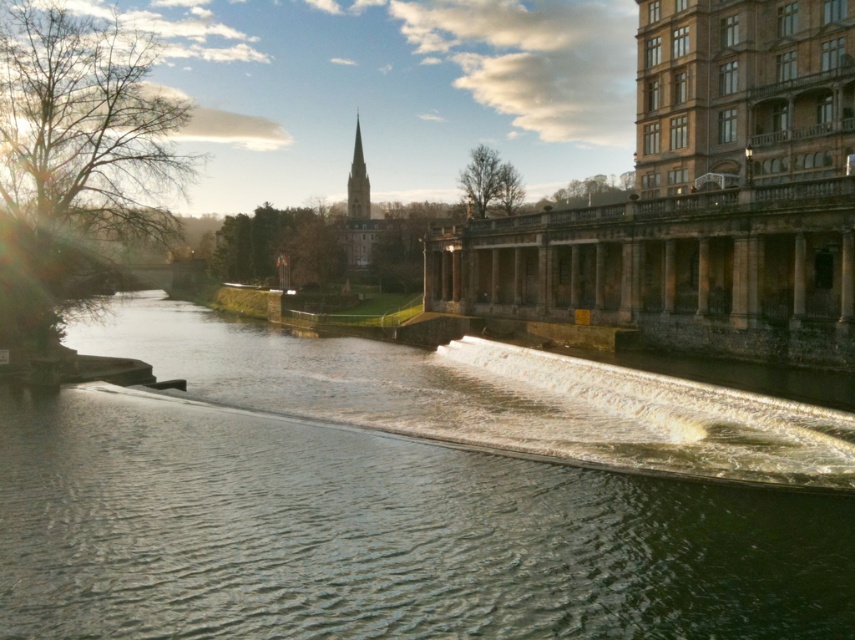
Question: Does greenish water at center come behind smooth gray steeple at upper center?

Choices:
 (A) no
 (B) yes

Answer: (A)

Question: Is the position of greenish water at center more distant than that of smooth gray steeple at upper center?

Choices:
 (A) yes
 (B) no

Answer: (B)

Question: Which point is closer to the camera taking this photo?

Choices:
 (A) (355, 140)
 (B) (105, 424)

Answer: (B)

Question: Does greenish water at center have a larger size compared to smooth gray steeple at upper center?

Choices:
 (A) yes
 (B) no

Answer: (B)

Question: Which of the following is the farthest from the observer?

Choices:
 (A) (358, 140)
 (B) (847, 532)

Answer: (A)